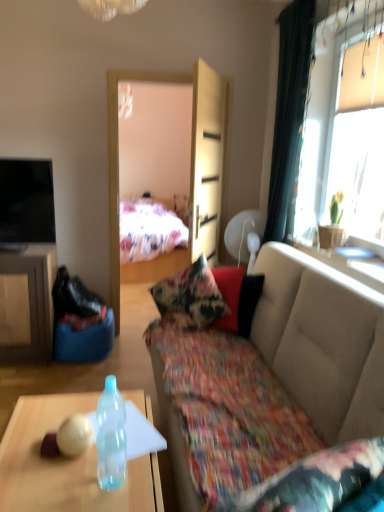
Question: Can you confirm if light wood armoire at center is bigger than floral fabric couch at center?

Choices:
 (A) yes
 (B) no

Answer: (B)

Question: Could floral fabric couch at center be considered to be inside light wood armoire at center?

Choices:
 (A) no
 (B) yes

Answer: (A)

Question: Is light wood armoire at center at the right side of floral fabric couch at center?

Choices:
 (A) no
 (B) yes

Answer: (A)

Question: Does light wood armoire at center have a lesser height compared to floral fabric couch at center?

Choices:
 (A) yes
 (B) no

Answer: (B)

Question: Could you tell me if light wood armoire at center is facing floral fabric couch at center?

Choices:
 (A) no
 (B) yes

Answer: (A)

Question: Visually, is light wood armoire at center positioned to the left or to the right of black fabric curtain at right?

Choices:
 (A) left
 (B) right

Answer: (A)

Question: Considering their positions, is light wood armoire at center located in front of or behind black fabric curtain at right?

Choices:
 (A) front
 (B) behind

Answer: (A)

Question: From a real-world perspective, is light wood armoire at center positioned above or below black fabric curtain at right?

Choices:
 (A) below
 (B) above

Answer: (A)

Question: From their relative heights in the image, would you say light wood armoire at center is taller or shorter than black fabric curtain at right?

Choices:
 (A) tall
 (B) short

Answer: (B)

Question: Visually, is black glossy tv at upper left positioned to the left or to the right of transparent plastic bottle at lower left?

Choices:
 (A) left
 (B) right

Answer: (A)

Question: From a real-world perspective, is black glossy tv at upper left above or below transparent plastic bottle at lower left?

Choices:
 (A) below
 (B) above

Answer: (B)

Question: In terms of size, does black glossy tv at upper left appear bigger or smaller than transparent plastic bottle at lower left?

Choices:
 (A) big
 (B) small

Answer: (B)

Question: Is point (34, 162) positioned closer to the camera than point (160, 492)?

Choices:
 (A) farther
 (B) closer

Answer: (A)

Question: From a real-world perspective, is transparent glass table at upper right above or below transparent plastic bottle at lower left?

Choices:
 (A) above
 (B) below

Answer: (A)

Question: Choose the correct answer: Is transparent glass table at upper right inside transparent plastic bottle at lower left or outside it?

Choices:
 (A) inside
 (B) outside

Answer: (B)